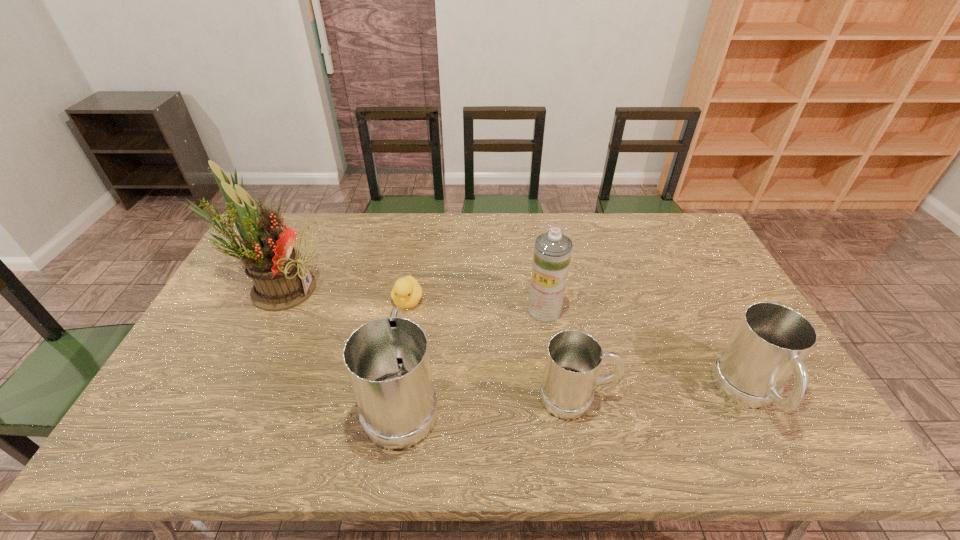
This screenshot has height=540, width=960. I want to click on vacant space located on the side of the leftmost mug with the handle, so click(x=411, y=340).

In order to click on vacant space located 0.340m on the side of the leftmost mug with the handle in this screenshot , I will do `click(421, 274)`.

At what (x,y) coordinates should I click in order to perform the action: click on vacant space located 0.130m on the side of the second mug from left to right with the handle. Please return your answer as a coordinate pair (x, y). The width and height of the screenshot is (960, 540). Looking at the image, I should click on (667, 397).

Identify the location of free space located 0.340m on the right of the aerosol can. (675, 310).

Identify the location of vacant space located 0.130m in front of the tallest object with the fan visible. Image resolution: width=960 pixels, height=540 pixels. (362, 288).

The image size is (960, 540). What are the coordinates of `vacant space located 0.140m on the front-facing side of the duck` in the screenshot? It's located at point(399,353).

I want to click on object located in the left edge section of the desktop, so click(x=282, y=280).

At what (x,y) coordinates should I click in order to perform the action: click on object located in the right edge section of the desktop. Please return your answer as a coordinate pair (x, y). Looking at the image, I should click on (767, 347).

Find the location of a particular element. object that is at the near right corner is located at coordinates (767, 347).

Identify the location of vacant space at the far edge. This screenshot has width=960, height=540. (373, 221).